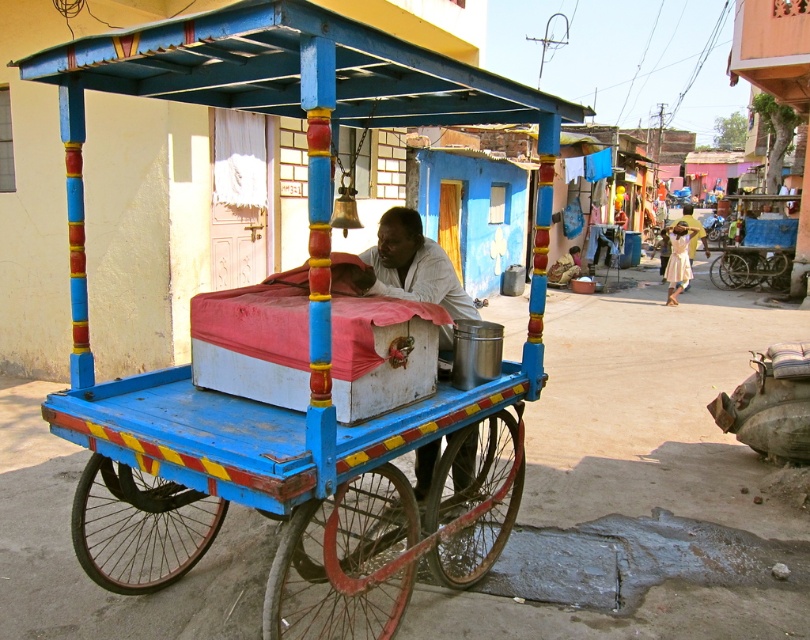
You are standing on the street and see both the wooden cart at center and the white matte cart at center. Which cart is positioned more to the left side of the street?

The wooden cart at center is positioned more to the left side of the street than the white matte cart at center.

From the picture: Based on the scene description, where is the wooden cart at center located in terms of its 2D coordinates?

The wooden cart at center is located at the 2D coordinates of point [293,340].

You are a customer looking to buy snacks from the carts in the scene. The wooden cart at center sells fresh fruits, while the white matte cart at center offers baked goods. If you want to see the vendor more clearly, which cart should you stand closer to?

The wooden cart at center is taller than the white matte cart at center, so standing closer to the wooden cart at center would allow you to see the vendor more clearly due to its height advantage.